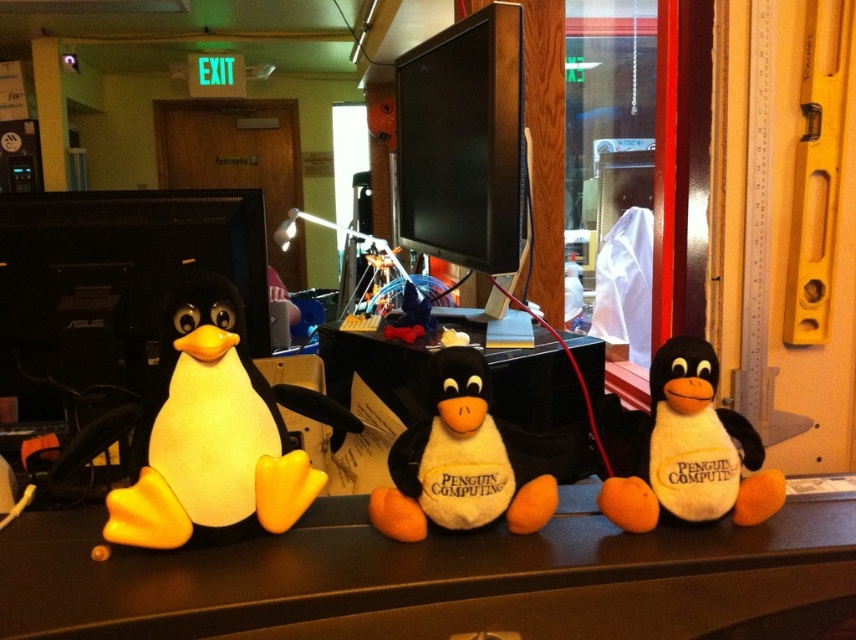
Measure the distance between white matte table at center and camera.

white matte table at center is 25.55 inches from camera.

Is point (458, 602) positioned before point (663, 486)?

Yes, it is in front of point (663, 486).

You are a GUI agent. You are given a task and a screenshot of the screen. Output one action in this format:
    pyautogui.click(x=<x>, y=<y>)
    Task: Click on the white matte table at center
    The height and width of the screenshot is (640, 856).
    Given the screenshot: What is the action you would take?
    pyautogui.click(x=425, y=579)

Does point (672, 500) come farther from viewer compared to point (467, 428)?

Yes, point (672, 500) is farther from viewer.

Does white plush penguin at center appear under white soft plush penguin at center?

Yes, white plush penguin at center is below white soft plush penguin at center.

Is point (702, 516) closer to camera compared to point (465, 445)?

No, it is not.

Identify the location of white plush penguin at center. (682, 449).

Is white matte table at center above white soft plush penguin at center?

No, white matte table at center is not above white soft plush penguin at center.

Between point (402, 621) and point (462, 349), which one is positioned in front?

Point (402, 621) is more forward.

This screenshot has width=856, height=640. What do you see at coordinates (425, 579) in the screenshot?
I see `white matte table at center` at bounding box center [425, 579].

In order to click on white matte table at center in this screenshot , I will do `click(425, 579)`.